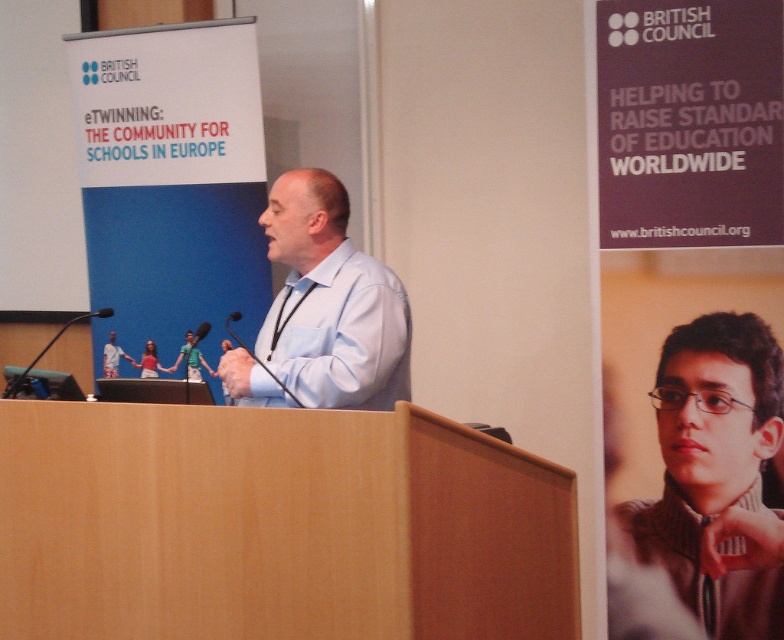
Question: Does brown striped shirt at center have a larger size compared to black matte microphone at center?

Choices:
 (A) no
 (B) yes

Answer: (A)

Question: Does light blue shirt at center lie in front of black matte microphone at center?

Choices:
 (A) yes
 (B) no

Answer: (B)

Question: Which point appears farthest from the camera in this image?

Choices:
 (A) (345, 221)
 (B) (224, 324)
 (C) (66, 321)

Answer: (C)

Question: Where is brown striped shirt at center located in relation to black matte microphone at center in the image?

Choices:
 (A) above
 (B) below

Answer: (B)

Question: Which object is the closest to the black matte microphone at center?

Choices:
 (A) light blue shirt at center
 (B) black plastic microphone at lower left
 (C) brown striped shirt at center

Answer: (A)

Question: Which of the following is the farthest from the observer?

Choices:
 (A) light blue shirt at center
 (B) black plastic microphone at lower left

Answer: (B)